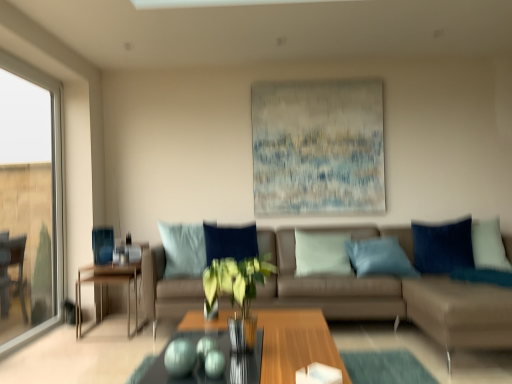
Question: Visually, is velvet blue pillow at right positioned to the left or to the right of wooden table at left?

Choices:
 (A) right
 (B) left

Answer: (A)

Question: Do you think velvet blue pillow at right is within wooden table at left, or outside of it?

Choices:
 (A) outside
 (B) inside

Answer: (A)

Question: Which is nearer to the textured canvas painting at upper center?

Choices:
 (A) transparent glass window at left
 (B) wooden coffee table at center
 (C) green leafy plant in glass vase at center
 (D) wooden table at left
 (E) suede beige couch at center

Answer: (E)

Question: Which is nearer to the green leafy plant in glass vase at center?

Choices:
 (A) textured canvas painting at upper center
 (B) velvet blue pillow at right
 (C) suede beige couch at center
 (D) wooden coffee table at center
 (E) wooden table at left

Answer: (D)